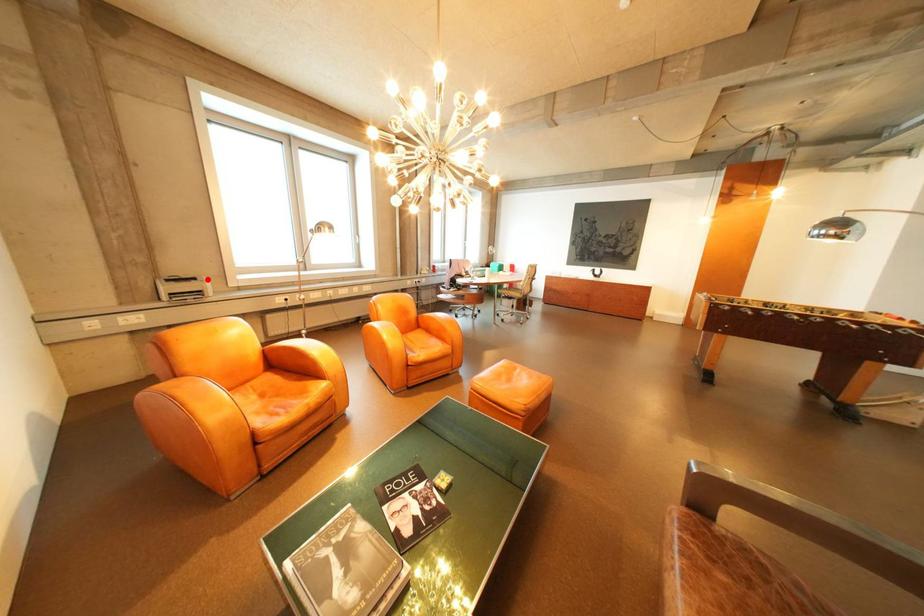
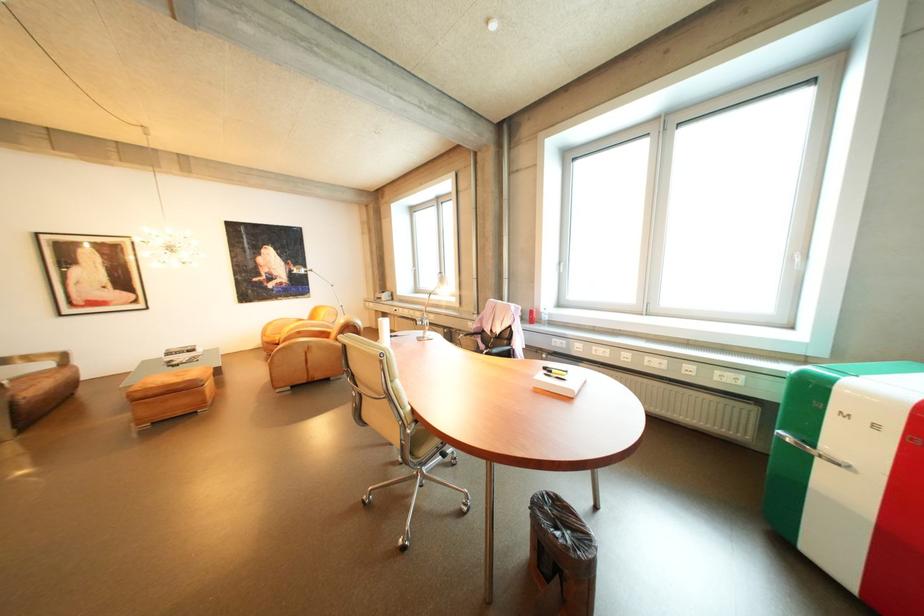
Question: I am providing you with two images of the same scene from different viewpoints. A red point is marked on the first image. Can you still see the location of the red point in image 2?

Choices:
 (A) Yes
 (B) No

Answer: (B)